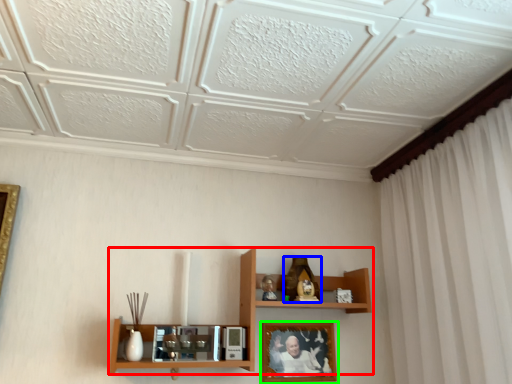
Question: Which object is the farthest from shelf (highlighted by a red box)? Choose among these: toy (highlighted by a blue box) or picture frame (highlighted by a green box).

Choices:
 (A) toy
 (B) picture frame

Answer: (A)